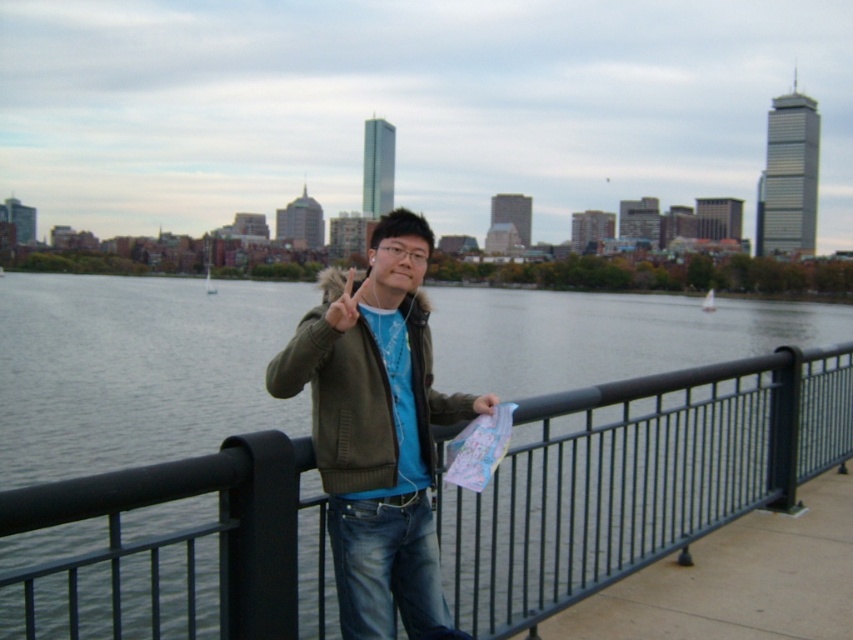
Does matte green jacket at center have a smaller size compared to green fuzzy jacket at center?

Incorrect, matte green jacket at center is not smaller in size than green fuzzy jacket at center.

What do you see at coordinates (376, 429) in the screenshot?
I see `matte green jacket at center` at bounding box center [376, 429].

Where is `matte green jacket at center`? Image resolution: width=853 pixels, height=640 pixels. matte green jacket at center is located at coordinates (376, 429).

I want to click on matte green jacket at center, so pos(376,429).

Between black metal fence at center and green fuzzy jacket at center, which one is positioned higher?

green fuzzy jacket at center

Locate an element on the screen. The image size is (853, 640). black metal fence at center is located at coordinates (637, 477).

Is point (660, 528) positioned after point (312, 348)?

Yes, point (660, 528) is farther from viewer.

Where is `black metal fence at center`? This screenshot has height=640, width=853. black metal fence at center is located at coordinates (637, 477).

Between point (260, 586) and point (425, 609), which one is positioned behind?

Positioned behind is point (425, 609).

The height and width of the screenshot is (640, 853). Find the location of `black metal fence at center`. black metal fence at center is located at coordinates (637, 477).

Where is `black metal fence at center`? The height and width of the screenshot is (640, 853). black metal fence at center is located at coordinates (637, 477).